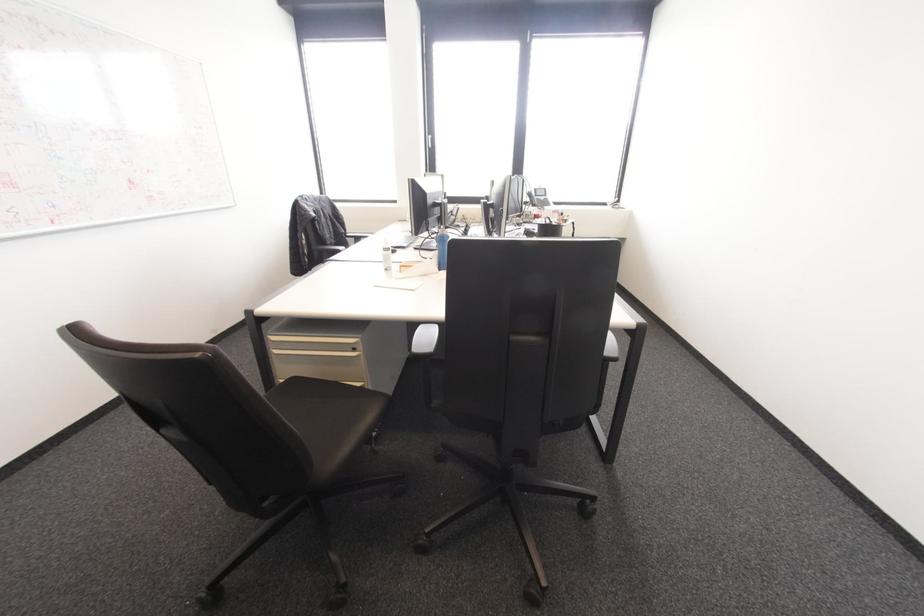
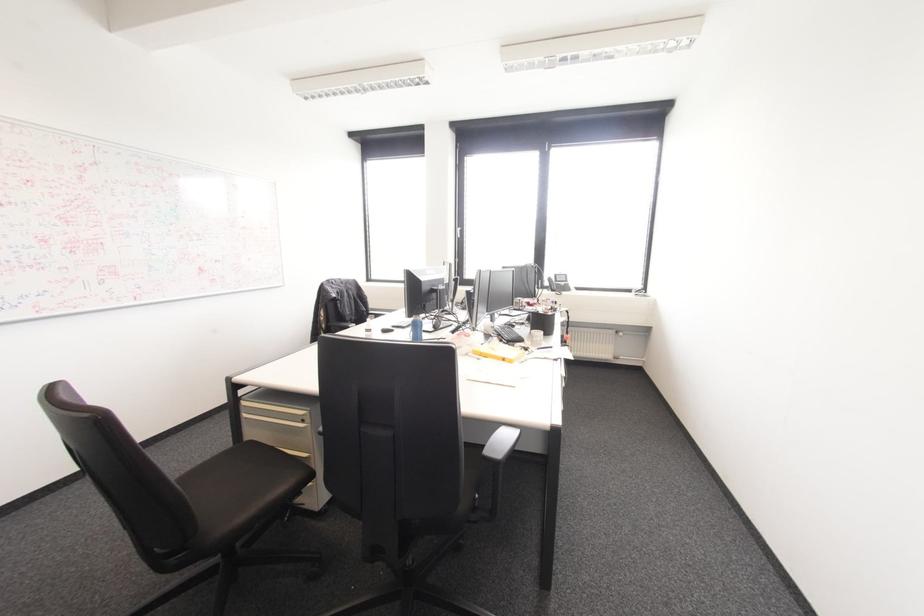
Question: Based on the continuous images, in which direction is the camera rotating? Reply with the corresponding letter.

Choices:
 (A) Left
 (B) Right
 (C) Up
 (D) Down

Answer: (A)